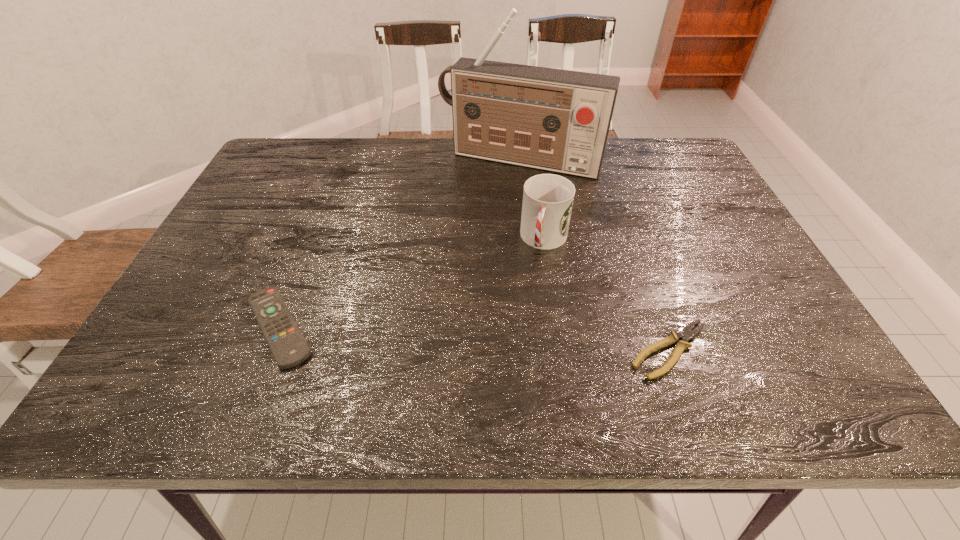
The height and width of the screenshot is (540, 960). In order to click on free space that is in between the third nearest object and the third tallest object in this screenshot , I will do `click(412, 284)`.

I want to click on unoccupied position between the pliers and the tallest object, so click(595, 255).

Locate an element on the screen. object that is the second closest to the pliers is located at coordinates (557, 120).

This screenshot has height=540, width=960. I want to click on object identified as the closest to the leftmost object, so click(x=548, y=199).

This screenshot has width=960, height=540. Find the location of `vacant position in the image that satisfies the following two spatial constraints: 1. on the front side of the cup; 2. on the right side of the farthest object`. vacant position in the image that satisfies the following two spatial constraints: 1. on the front side of the cup; 2. on the right side of the farthest object is located at coordinates (530, 240).

At what (x,y) coordinates should I click in order to perform the action: click on free point that satisfies the following two spatial constraints: 1. on the front side of the third shortest object; 2. on the left side of the tallest object. Please return your answer as a coordinate pair (x, y). Looking at the image, I should click on (530, 240).